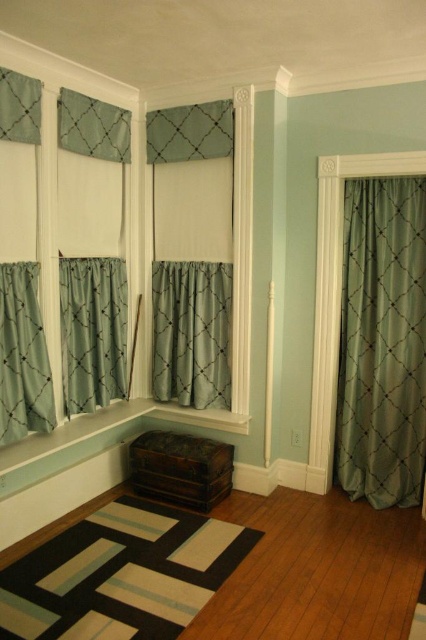
You are standing in the room and want to know the exact position of the green silk curtain at right. Can you tell me where it is located in the room?

The green silk curtain at right is located at the 2D coordinates point (x=382, y=342).

Based on the photo, you are standing in the room and want to adjust the curtains. Which curtain is positioned to the right side of the other, the matte teal curtain at center or the matte teal curtain at left?

The matte teal curtain at center is positioned to the right of the matte teal curtain at left.

You are standing in the room and want to place a 4 feet wide decorative shelf between the green silk curtain at right and the satin teal curtain at center. Can the shelf fit between them?

The green silk curtain at right is 3.50 feet from the satin teal curtain at center. Since the shelf is 4 feet wide, which is wider than the 3.50 feet distance between the curtains, the shelf cannot fit between them.